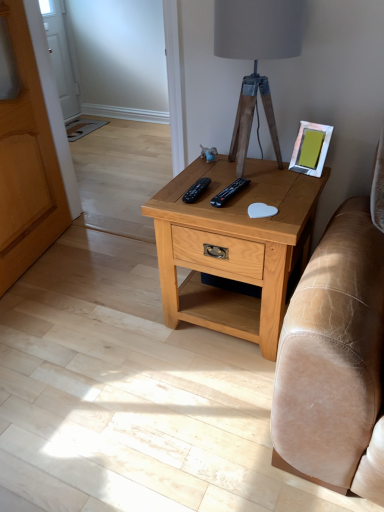
Locate an element on the screen. This screenshot has height=512, width=384. light brown wood nightstand at center is located at coordinates (233, 247).

Is wooden armoire at left positioned with its back to black plastic remote at center, which is the second remote in left-to-right order?

No, wooden armoire at left's orientation is not away from black plastic remote at center, which is the second remote in left-to-right order.

Can you see wooden armoire at left touching black plastic remote at center, which is the 1th remote in right-to-left order?

wooden armoire at left and black plastic remote at center, which is the 1th remote in right-to-left order, are not in contact.

Locate an element on the screen. armoire below the black plastic remote at center, which is the second remote in left-to-right order (from a real-world perspective) is located at coordinates (26, 162).

Is wooden armoire at left bigger or smaller than black plastic remote at center, which is the 1th remote in right-to-left order?

Considering their sizes, wooden armoire at left takes up more space than black plastic remote at center, which is the 1th remote in right-to-left order.

Is wooden armoire at left facing away from light brown wood nightstand at center?

wooden armoire at left is not turned away from light brown wood nightstand at center.

Can you tell me how much wooden armoire at left and light brown wood nightstand at center differ in facing direction?

101 degrees.

Can we say wooden armoire at left lies outside light brown wood nightstand at center?

Absolutely, wooden armoire at left is external to light brown wood nightstand at center.

Considering the sizes of objects wooden armoire at left and light brown wood nightstand at center in the image provided, who is wider, wooden armoire at left or light brown wood nightstand at center?

With larger width is light brown wood nightstand at center.

Is wooden armoire at left closer to the viewer compared to black plastic remote at center, placed as the first remote when sorted from left to right?

Yes, wooden armoire at left is closer to the viewer.

From their relative heights in the image, would you say wooden armoire at left is taller or shorter than black plastic remote at center, placed as the first remote when sorted from left to right?

Considering their sizes, wooden armoire at left has more height than black plastic remote at center, placed as the first remote when sorted from left to right.

In the scene shown: Which is more distant, (41, 140) or (183, 198)?

The point (41, 140) is behind.

From a real-world perspective, is wooden tripod lamp at center on black plastic remote at center, which is the 1th remote in right-to-left order?

Yes, from a real-world perspective, wooden tripod lamp at center is on top of black plastic remote at center, which is the 1th remote in right-to-left order.

Does wooden tripod lamp at center appear on the left side of black plastic remote at center, which is the second remote in left-to-right order?

In fact, wooden tripod lamp at center is to the right of black plastic remote at center, which is the second remote in left-to-right order.

Considering the relative sizes of wooden tripod lamp at center and black plastic remote at center, which is the 1th remote in right-to-left order, in the image provided, is wooden tripod lamp at center wider than black plastic remote at center, which is the 1th remote in right-to-left order,?

Indeed, wooden tripod lamp at center has a greater width compared to black plastic remote at center, which is the 1th remote in right-to-left order.

Is black plastic remote at center, which is the second remote in left-to-right order, at the back of wooden tripod lamp at center?

No.

The width and height of the screenshot is (384, 512). I want to click on remote that is the 2nd one below the wooden tripod lamp at center (from a real-world perspective), so click(196, 190).

Which of these two, black plastic remote at center, placed as the first remote when sorted from left to right, or wooden tripod lamp at center, stands taller?

Standing taller between the two is wooden tripod lamp at center.

Is black plastic remote at center, placed as the first remote when sorted from left to right, oriented away from wooden tripod lamp at center?

Yes, black plastic remote at center, placed as the first remote when sorted from left to right,'s orientation is away from wooden tripod lamp at center.

Would you say black plastic remote at center, placed as the first remote when sorted from left to right, is inside or outside wooden tripod lamp at center?

black plastic remote at center, placed as the first remote when sorted from left to right, is outside wooden tripod lamp at center.

Is point (222, 205) positioned in front of point (299, 149)?

That is True.

Can you tell me how much black plastic remote at center, which is the second remote in left-to-right order, and metallic silver picture frame at upper right differ in facing direction?

8.91 degrees separate the facing orientations of black plastic remote at center, which is the second remote in left-to-right order, and metallic silver picture frame at upper right.

Is black plastic remote at center, which is the second remote in left-to-right order, oriented towards metallic silver picture frame at upper right?

No, black plastic remote at center, which is the second remote in left-to-right order, is not facing towards metallic silver picture frame at upper right.

Considering the sizes of objects black plastic remote at center, which is the 1th remote in right-to-left order, and metallic silver picture frame at upper right in the image provided, who is taller, black plastic remote at center, which is the 1th remote in right-to-left order, or metallic silver picture frame at upper right?

metallic silver picture frame at upper right is taller.

Where is `remote below the black plastic remote at center, the 2th remote positioned from the right (from the image's perspective)`? The height and width of the screenshot is (512, 384). remote below the black plastic remote at center, the 2th remote positioned from the right (from the image's perspective) is located at coordinates (229, 192).

From the image's perspective, is black plastic remote at center, placed as the first remote when sorted from left to right, under black plastic remote at center, which is the 1th remote in right-to-left order?

Incorrect, from the image's perspective, black plastic remote at center, placed as the first remote when sorted from left to right, is higher than black plastic remote at center, which is the 1th remote in right-to-left order.

Which of these two, black plastic remote at center, the 2th remote positioned from the right, or black plastic remote at center, which is the 1th remote in right-to-left order, is smaller?

black plastic remote at center, which is the 1th remote in right-to-left order.

The width and height of the screenshot is (384, 512). I want to click on armoire in front of the black plastic remote at center, which is the second remote in left-to-right order, so click(26, 162).

Identify the location of armoire above the light brown wood nightstand at center (from the image's perspective). (26, 162).

From the image, which object appears to be nearer to metallic silver picture frame at upper right, black plastic remote at center, the 2th remote positioned from the right, or black plastic remote at center, which is the 1th remote in right-to-left order?

black plastic remote at center, which is the 1th remote in right-to-left order, is closer to metallic silver picture frame at upper right.

Considering their positions, is metallic silver picture frame at upper right positioned closer to black plastic remote at center, placed as the first remote when sorted from left to right, than wooden tripod lamp at center?

metallic silver picture frame at upper right is closer to black plastic remote at center, placed as the first remote when sorted from left to right.

From the image, which object appears to be nearer to metallic silver picture frame at upper right, wooden armoire at left or light brown wood nightstand at center?

light brown wood nightstand at center.

Estimate the real-world distances between objects in this image. Which object is closer to wooden armoire at left, wooden tripod lamp at center or black plastic remote at center, which is the second remote in left-to-right order?

Based on the image, wooden tripod lamp at center appears to be nearer to wooden armoire at left.

Which object lies nearer to the anchor point wooden armoire at left, black plastic remote at center, the 2th remote positioned from the right, or wooden tripod lamp at center?

black plastic remote at center, the 2th remote positioned from the right, is positioned closer to the anchor wooden armoire at left.

When comparing their distances from metallic silver picture frame at upper right, does wooden armoire at left or black plastic remote at center, the 2th remote positioned from the right, seem further?

wooden armoire at left is further to metallic silver picture frame at upper right.

Which object lies further to the anchor point wooden armoire at left, black plastic remote at center, which is the 1th remote in right-to-left order, or metallic silver picture frame at upper right?

metallic silver picture frame at upper right lies further to wooden armoire at left than the other object.

Consider the image. Based on their spatial positions, is metallic silver picture frame at upper right or light brown wood nightstand at center further from wooden tripod lamp at center?

Based on the image, light brown wood nightstand at center appears to be further to wooden tripod lamp at center.

The image size is (384, 512). I want to click on nightstand between wooden armoire at left and metallic silver picture frame at upper right from left to right, so click(233, 247).

Where is `table lamp located between black plastic remote at center, the 2th remote positioned from the right, and metallic silver picture frame at upper right in the left-right direction`? The width and height of the screenshot is (384, 512). table lamp located between black plastic remote at center, the 2th remote positioned from the right, and metallic silver picture frame at upper right in the left-right direction is located at coordinates (256, 57).

You are a GUI agent. You are given a task and a screenshot of the screen. Output one action in this format:
    pyautogui.click(x=<x>, y=<y>)
    Task: Click on the remote between black plastic remote at center, placed as the first remote when sorted from left to right, and light brown wood nightstand at center, in the vertical direction
    
    Given the screenshot: What is the action you would take?
    pyautogui.click(x=229, y=192)

Identify the location of remote between wooden tripod lamp at center and black plastic remote at center, which is the second remote in left-to-right order, in the up-down direction. (196, 190).